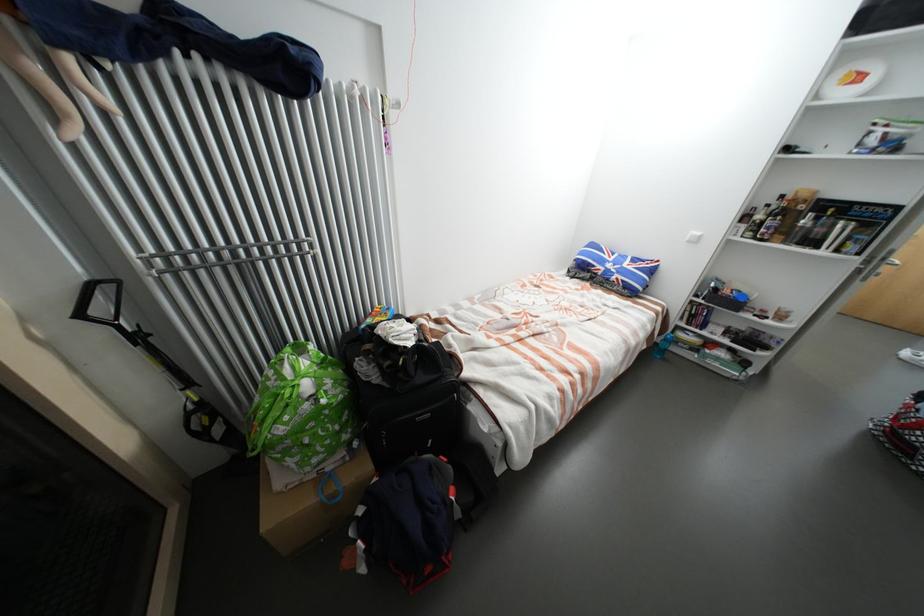
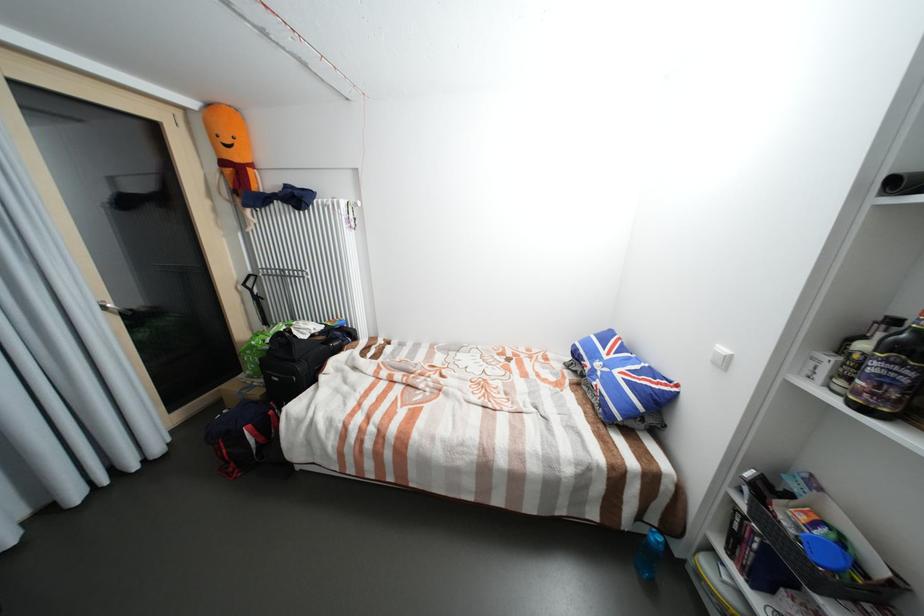
The point at (774, 206) is marked in the first image. Where is the corresponding point in the second image?

(901, 322)